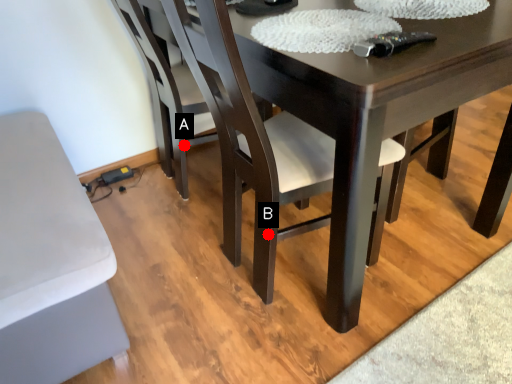
Question: Two points are circled on the image, labeled by A and B beside each circle. Which point is further to the camera?

Choices:
 (A) A is further
 (B) B is further

Answer: (A)